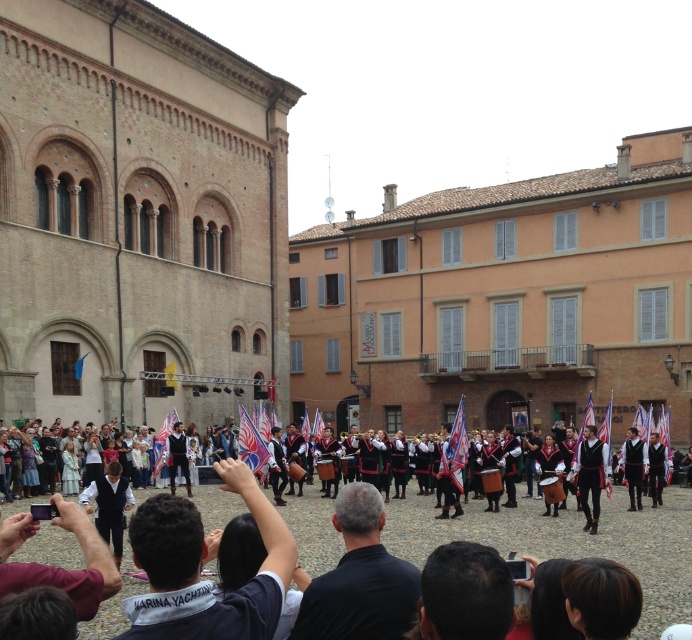
Is dark brown hair at center to the right of maroon fabric shirt at lower left from the viewer's perspective?

Correct, you'll find dark brown hair at center to the right of maroon fabric shirt at lower left.

Does point (432, 580) come behind point (95, 552)?

No, it is in front of (95, 552).

Locate an element on the screen. The image size is (692, 640). dark brown hair at center is located at coordinates (464, 593).

Who is more distant from viewer, (x=254, y=500) or (x=111, y=580)?

Positioned behind is point (x=254, y=500).

Does dark blue shirt at center appear over maroon fabric shirt at lower left?

Yes, dark blue shirt at center is above maroon fabric shirt at lower left.

Measure the distance between dark blue shirt at center and camera.

dark blue shirt at center and camera are 19.62 meters apart from each other.

Locate an element on the screen. dark blue shirt at center is located at coordinates (200, 566).

Based on the photo, who is positioned more to the left, black cotton shirt at center or dark blue fabric at center?

black cotton shirt at center is more to the left.

Between point (313, 592) and point (641, 481), which one is positioned behind?

Point (641, 481)

Identify the location of black cotton shirt at center. (358, 579).